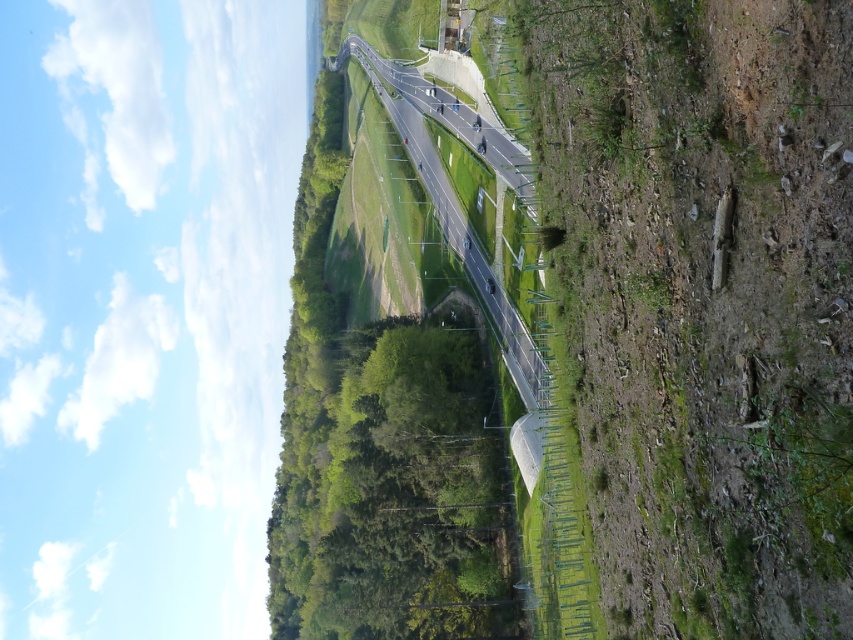
You are a surveyor measuring the height of the dull green grass at lower right and the asphalt road at center. Which one has a greater height?

The asphalt road at center is taller than the dull green grass at lower right.

You are a surveyor measuring the width of the road and the grassy area. Based on the image, which area is narrower between the dull green grass at lower right and the asphalt road at center?

The dull green grass at lower right has a lesser width compared to the asphalt road at center, so the grass area is narrower than the road.